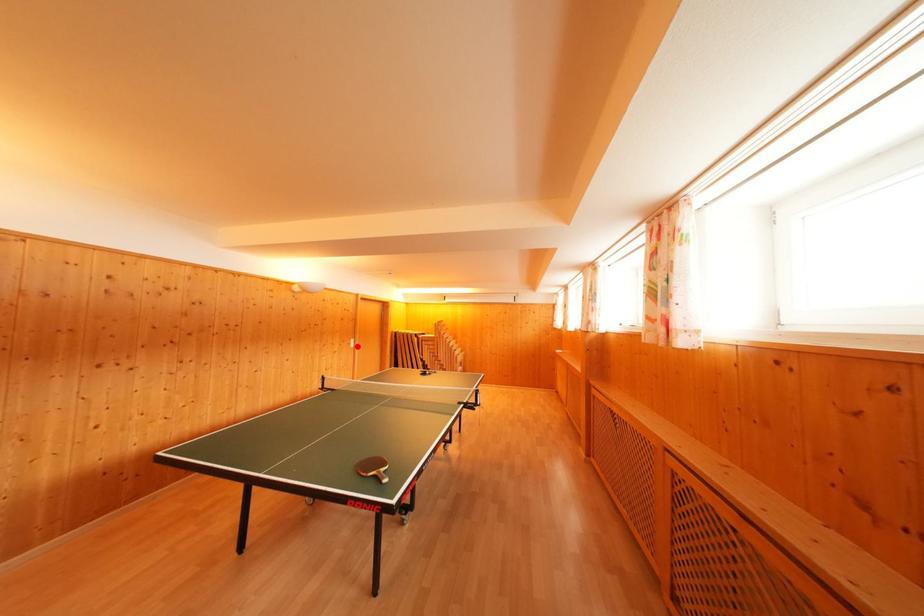
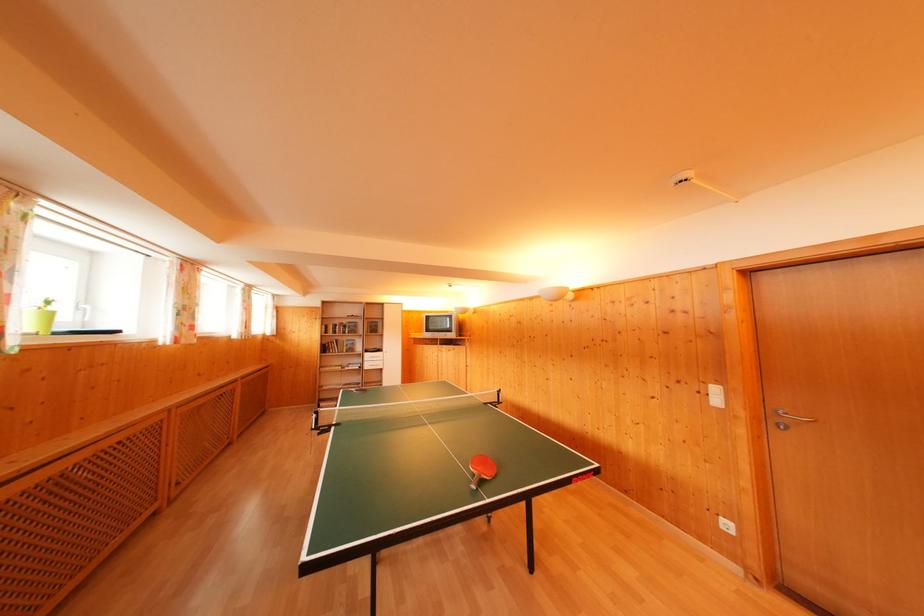
Locate, in the second image, the point that corresponds to the highlighted location in the first image.

(721, 395)